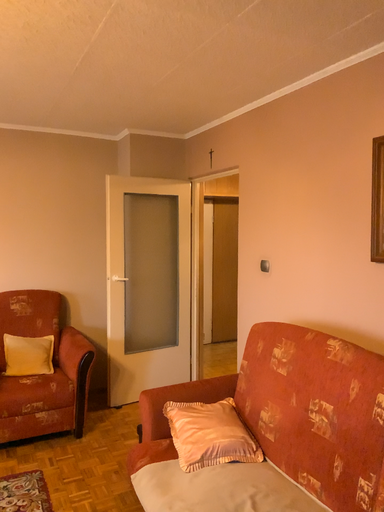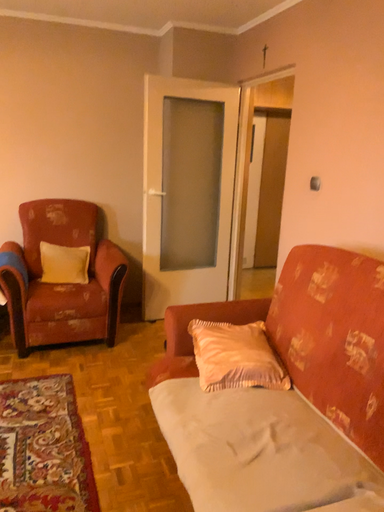
Question: How did the camera likely rotate when shooting the video?

Choices:
 (A) rotated right
 (B) rotated left

Answer: (B)